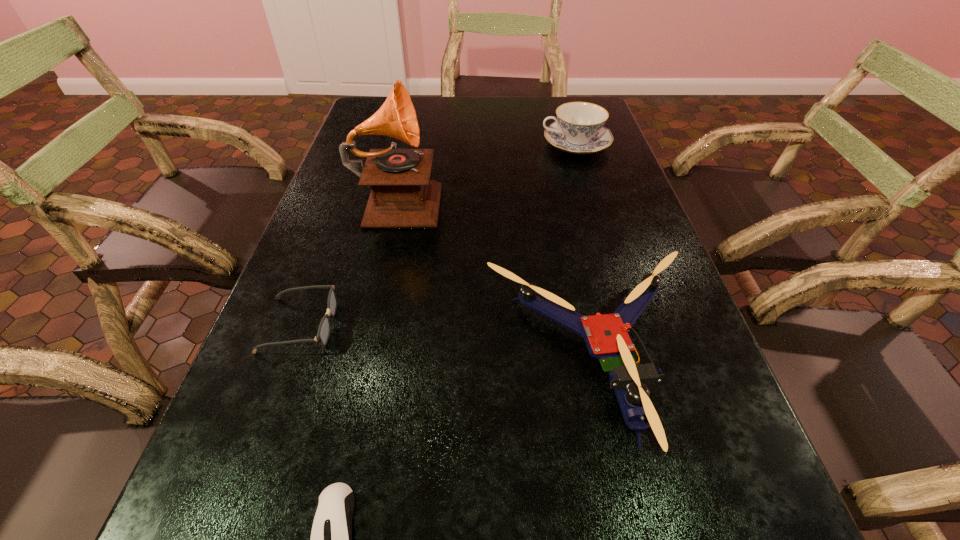
This screenshot has width=960, height=540. Find the location of `the tallest object`. the tallest object is located at coordinates (402, 196).

Locate an element on the screen. The height and width of the screenshot is (540, 960). phonograph record is located at coordinates (402, 196).

Where is `chinaware`? Image resolution: width=960 pixels, height=540 pixels. chinaware is located at coordinates (578, 129).

Locate an element on the screen. The width and height of the screenshot is (960, 540). drone is located at coordinates [606, 336].

Find the location of a particular element. The height and width of the screenshot is (540, 960). the second shortest object is located at coordinates (323, 333).

Image resolution: width=960 pixels, height=540 pixels. I want to click on vacant space situated on the horn of the phonograph record, so click(551, 198).

At what (x,y) coordinates should I click in order to perform the action: click on vacant area situated 0.360m with the handle on the side of the farthest object. Please return your answer as a coordinate pair (x, y). This screenshot has width=960, height=540. Looking at the image, I should click on (420, 144).

Image resolution: width=960 pixels, height=540 pixels. I want to click on vacant region located with the handle on the side of the farthest object, so click(517, 144).

Locate an element on the screen. The width and height of the screenshot is (960, 540). blank space located with the handle on the side of the farthest object is located at coordinates (444, 144).

Locate an element on the screen. free point located 0.090m on the back of the drone is located at coordinates (571, 248).